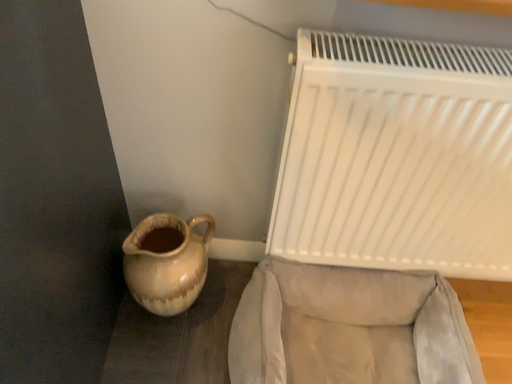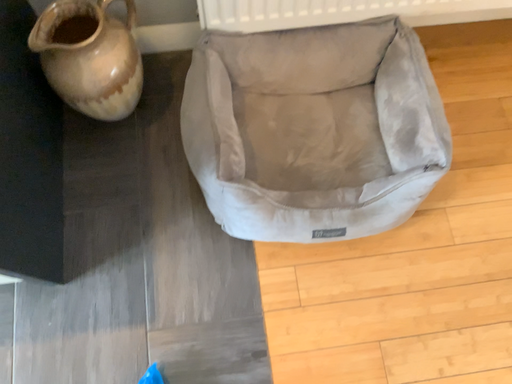
Question: Which way did the camera rotate in the video?

Choices:
 (A) rotated upward
 (B) rotated downward

Answer: (B)